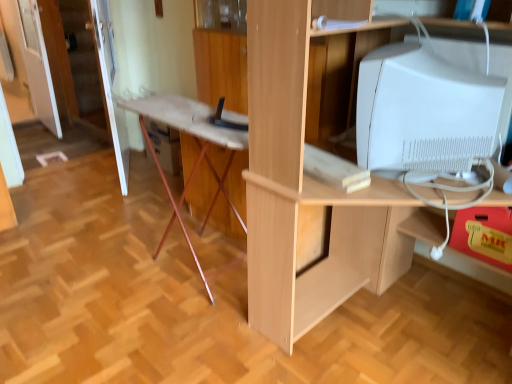
I want to click on free space in front of wooden ironing board at center, so click(166, 324).